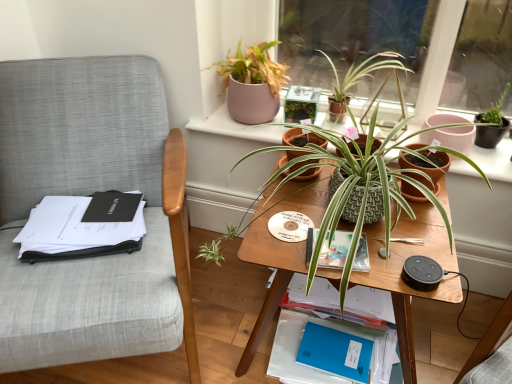
How much space does hardcover book at center, which appears as the 2th paperback book when viewed from the back, occupy vertically?

hardcover book at center, which appears as the 2th paperback book when viewed from the back, is 0.75 inches tall.

In order to face green leafy plant at center, the second houseplant when ordered from top to bottom, should I rotate leftwards or rightwards?

To align with it, rotate right about 13.931°.

What do you see at coordinates (369, 75) in the screenshot?
I see `green leafy plant at center, the second houseplant when ordered from bottom to top` at bounding box center [369, 75].

The width and height of the screenshot is (512, 384). I want to click on blue matte paperback book at lower center, the second paperback book in the front-to-back sequence, so click(335, 352).

I want to click on terracotta clay pot at center-right, the 1th flowerpot viewed from the right, so pyautogui.click(x=426, y=168).

At what (x,y) coordinates should I click in order to perform the action: click on blue matte notebook at lower center. Please return your answer as a coordinate pair (x, y). Looking at the image, I should click on (370, 304).

What's the angular difference between blue matte notebook at lower center and terracotta clay pot at center-right, which is counted as the second flowerpot, starting from the left,'s facing directions?

0.941 degrees.

Is point (284, 352) farther from camera compared to point (409, 195)?

Yes, it is.

From a real-world perspective, is blue matte notebook at lower center positioned above or below terracotta clay pot at center-right, which is counted as the second flowerpot, starting from the left?

blue matte notebook at lower center is below terracotta clay pot at center-right, which is counted as the second flowerpot, starting from the left.

Measure the distance between blue matte notebook at lower center and terracotta clay pot at center-right, which is counted as the second flowerpot, starting from the left.

blue matte notebook at lower center is 20.34 inches away from terracotta clay pot at center-right, which is counted as the second flowerpot, starting from the left.

Considering the relative sizes of blue matte notebook at lower center and green textured pot at center, which appears as the first flowerpot when viewed from the left, in the image provided, is blue matte notebook at lower center wider than green textured pot at center, which appears as the first flowerpot when viewed from the left,?

Yes, blue matte notebook at lower center is wider than green textured pot at center, which appears as the first flowerpot when viewed from the left.

Between point (293, 294) and point (297, 131), which one is positioned behind?

The point (293, 294) is farther from the camera.

Is blue matte notebook at lower center far away from green textured pot at center, placed as the 2th flowerpot when sorted from right to left?

They are positioned close to each other.

Looking at this image, from a real-world perspective, is terracotta pots at upper center positioned over textured terracotta pot at center, which is the first houseplant in bottom-to-top order, based on gravity?

No, from a real-world perspective, terracotta pots at upper center is not above textured terracotta pot at center, which is the first houseplant in bottom-to-top order.

The height and width of the screenshot is (384, 512). I want to click on houseplant in front of the terracotta pots at upper center, so click(x=356, y=188).

Could textured terracotta pot at center, which is the first houseplant in bottom-to-top order, be considered to be inside terracotta pots at upper center?

No, textured terracotta pot at center, which is the first houseplant in bottom-to-top order, is not inside terracotta pots at upper center.

Considering the sizes of objects terracotta pots at upper center and textured terracotta pot at center, which is the first houseplant in bottom-to-top order, in the image provided, who is thinner, terracotta pots at upper center or textured terracotta pot at center, which is the first houseplant in bottom-to-top order,?

Thinner between the two is terracotta pots at upper center.

From a real-world perspective, does green textured pot at center, which appears as the first flowerpot when viewed from the left, sit lower than green leafy plant at center, the second houseplant when ordered from bottom to top?

Yes, from a real-world perspective, green textured pot at center, which appears as the first flowerpot when viewed from the left, is beneath green leafy plant at center, the second houseplant when ordered from bottom to top.

Is green textured pot at center, placed as the 2th flowerpot when sorted from right to left, next to green leafy plant at center, the second houseplant when ordered from top to bottom, and touching it?

No, green textured pot at center, placed as the 2th flowerpot when sorted from right to left, is not with green leafy plant at center, the second houseplant when ordered from top to bottom.

Considering the positions of objects green textured pot at center, which appears as the first flowerpot when viewed from the left, and green leafy plant at center, the second houseplant when ordered from bottom to top, in the image provided, who is behind, green textured pot at center, which appears as the first flowerpot when viewed from the left, or green leafy plant at center, the second houseplant when ordered from bottom to top,?

green leafy plant at center, the second houseplant when ordered from bottom to top, is more distant.

Consider the image. In terms of size, does matte pink pot at upper center, the 1th houseplant viewed from the top, appear bigger or smaller than hardcover book at center, the 1th paperback book positioned from the top?

In the image, matte pink pot at upper center, the 1th houseplant viewed from the top, appears to be larger than hardcover book at center, the 1th paperback book positioned from the top.

Is matte pink pot at upper center, the 1th houseplant viewed from the top, not near hardcover book at center, which is the first paperback book from front to back?

matte pink pot at upper center, the 1th houseplant viewed from the top, is near hardcover book at center, which is the first paperback book from front to back, not far away.

Could you measure the distance between matte pink pot at upper center, which ranks as the third houseplant in bottom-to-top order, and hardcover book at center, which is the first paperback book from front to back?

24.24 inches.

From the image's perspective, which one is positioned lower, matte pink pot at upper center, the 1th houseplant viewed from the top, or hardcover book at center, which is the first paperback book from front to back?

hardcover book at center, which is the first paperback book from front to back, from the image's perspective.

Is matte pink pot at upper center, which ranks as the third houseplant in bottom-to-top order, inside or outside of blue matte paperback book at lower center, which is the 1th paperback book in back-to-front order?

matte pink pot at upper center, which ranks as the third houseplant in bottom-to-top order, exists outside the volume of blue matte paperback book at lower center, which is the 1th paperback book in back-to-front order.

Could you tell me if matte pink pot at upper center, which ranks as the third houseplant in bottom-to-top order, is facing blue matte paperback book at lower center, which is the 1th paperback book in back-to-front order?

No.

Which point is more forward, (225,77) or (343,360)?

The point (343,360) is closer.

Identify the location of houseplant that is the 1st one when counting backward from the blue matte paperback book at lower center, the second paperback book in the front-to-back sequence. (252, 83).

Is textured gray fabric chair at left not inside terracotta pots at upper center?

Indeed, textured gray fabric chair at left is completely outside terracotta pots at upper center.

The height and width of the screenshot is (384, 512). Find the location of `window sill above the textured gray fabric chair at left (from the image's perspective)`. window sill above the textured gray fabric chair at left (from the image's perspective) is located at coordinates (234, 127).

From the image's perspective, which object appears higher, textured gray fabric chair at left or terracotta pots at upper center?

terracotta pots at upper center is shown above in the image.

From a real-world perspective, does textured gray fabric chair at left sit lower than terracotta pots at upper center?

Indeed, from a real-world perspective, textured gray fabric chair at left is positioned beneath terracotta pots at upper center.

The height and width of the screenshot is (384, 512). In order to click on flowerpot that is the 2nd one when counting forward from the blue matte notebook at lower center in this screenshot , I will do `click(426, 168)`.

At what (x,y) coordinates should I click in order to perform the action: click on the 2nd flowerpot above the blue matte notebook at lower center (from a real-world perspective). Please return your answer as a coordinate pair (x, y). The width and height of the screenshot is (512, 384). Looking at the image, I should click on (302, 138).

Estimate the real-world distances between objects in this image. Which object is further from textured terracotta pot at center, positioned as the third houseplant in top-to-bottom order, terracotta clay pot at center-right, which is counted as the second flowerpot, starting from the left, or blue matte notebook at lower center?

blue matte notebook at lower center is further to textured terracotta pot at center, positioned as the third houseplant in top-to-bottom order.

When comparing their distances from terracotta pots at upper center, does wooden table at center or terracotta clay pot at center-right, the 1th flowerpot viewed from the right, seem further?

wooden table at center is further to terracotta pots at upper center.

Based on the photo, when comparing their distances from blue matte paperback book at lower center, which is the 1th paperback book in back-to-front order, does terracotta clay pot at center-right, the 1th flowerpot viewed from the right, or wooden table at center seem further?

terracotta clay pot at center-right, the 1th flowerpot viewed from the right, is further to blue matte paperback book at lower center, which is the 1th paperback book in back-to-front order.

Considering their positions, is blue matte notebook at lower center positioned closer to green textured pot at center, placed as the 2th flowerpot when sorted from right to left, than wooden table at center?

wooden table at center is closer to green textured pot at center, placed as the 2th flowerpot when sorted from right to left.

Based on their spatial positions, is matte pink pot at upper center, the 1th houseplant viewed from the top, or green leafy plant at center, the second houseplant when ordered from top to bottom, closer to blue matte notebook at lower center?

Based on the image, green leafy plant at center, the second houseplant when ordered from top to bottom, appears to be nearer to blue matte notebook at lower center.

Considering their positions, is green textured pot at center, placed as the 2th flowerpot when sorted from right to left, positioned closer to textured terracotta pot at center, which is the first houseplant in bottom-to-top order, than terracotta clay pot at center-right, which is counted as the second flowerpot, starting from the left?

The object closer to textured terracotta pot at center, which is the first houseplant in bottom-to-top order, is green textured pot at center, placed as the 2th flowerpot when sorted from right to left.

Looking at the image, which one is located closer to green leafy plant at center, the second houseplant when ordered from top to bottom, textured gray fabric chair at left or blue matte notebook at lower center?

blue matte notebook at lower center is closer to green leafy plant at center, the second houseplant when ordered from top to bottom.

When comparing their distances from blue matte notebook at lower center, does wooden table at center or matte pink pot at upper center, which ranks as the third houseplant in bottom-to-top order, seem further?

matte pink pot at upper center, which ranks as the third houseplant in bottom-to-top order, is positioned further to the anchor blue matte notebook at lower center.

Identify the location of flowerpot between textured gray fabric chair at left and textured terracotta pot at center, positioned as the third houseplant in top-to-bottom order, in the horizontal direction. (302, 138).

Identify the location of paperback book between hardcover book at center, which appears as the 2th paperback book when viewed from the back, and blue matte notebook at lower center in the up-down direction. This screenshot has height=384, width=512. (335, 352).

I want to click on flowerpot between textured gray fabric chair at left and terracotta clay pot at center-right, which is counted as the second flowerpot, starting from the left, in the horizontal direction, so click(x=302, y=138).

The height and width of the screenshot is (384, 512). What are the coordinates of `paperback book between textured terracotta pot at center, which is the first houseplant in bottom-to-top order, and terracotta pots at upper center, along the z-axis` in the screenshot? It's located at (335, 250).